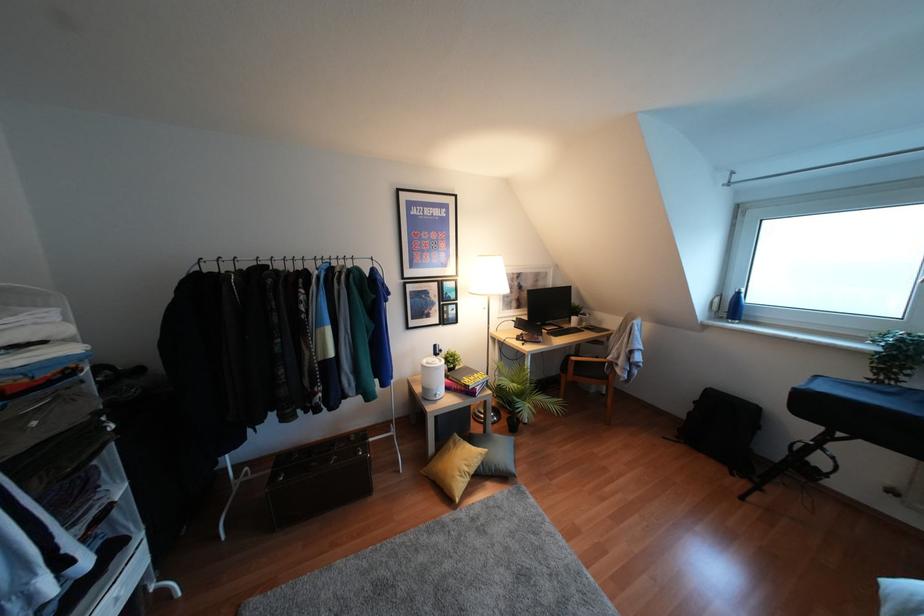
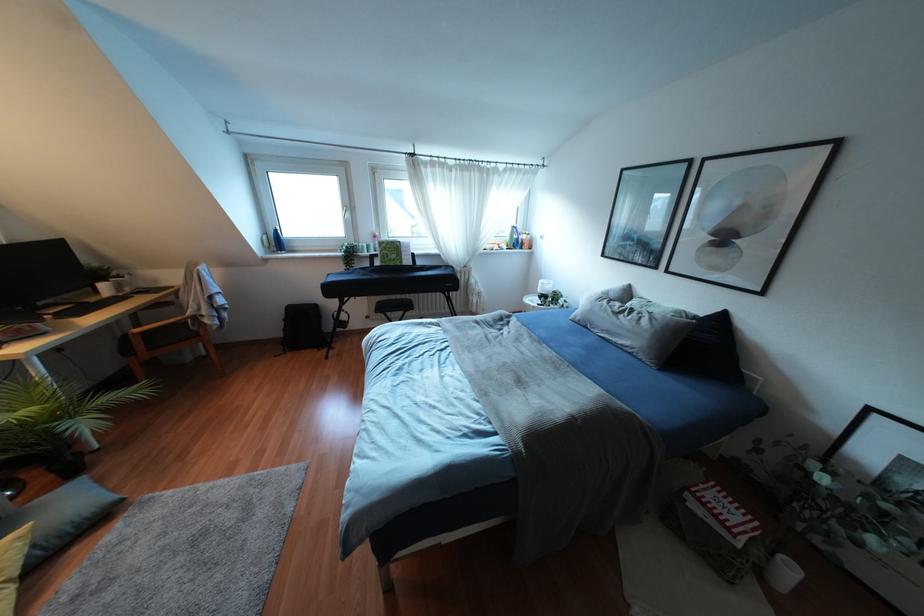
Locate, in the second image, the point that corresponds to (732,308) in the first image.

(275, 241)